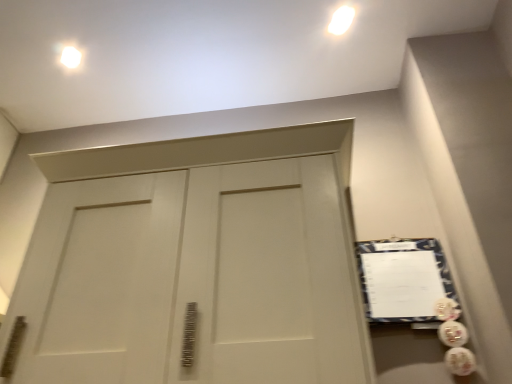
Question: Do you think white glossy light fixture at upper left is within white fabric bulletin board at right, or outside of it?

Choices:
 (A) outside
 (B) inside

Answer: (A)

Question: Does point (73, 49) appear closer or farther from the camera than point (408, 268)?

Choices:
 (A) closer
 (B) farther

Answer: (B)

Question: From a real-world perspective, is white glossy light fixture at upper left positioned above or below white fabric bulletin board at right?

Choices:
 (A) above
 (B) below

Answer: (A)

Question: Does point (381, 264) appear closer or farther from the camera than point (69, 49)?

Choices:
 (A) farther
 (B) closer

Answer: (B)

Question: Would you say white fabric bulletin board at right is to the left or to the right of white glossy light fixture at upper left in the picture?

Choices:
 (A) right
 (B) left

Answer: (A)

Question: Considering the positions of white fabric bulletin board at right and white glossy light fixture at upper left in the image, is white fabric bulletin board at right wider or thinner than white glossy light fixture at upper left?

Choices:
 (A) wide
 (B) thin

Answer: (B)

Question: Is white fabric bulletin board at right inside the boundaries of white glossy light fixture at upper left, or outside?

Choices:
 (A) outside
 (B) inside

Answer: (A)